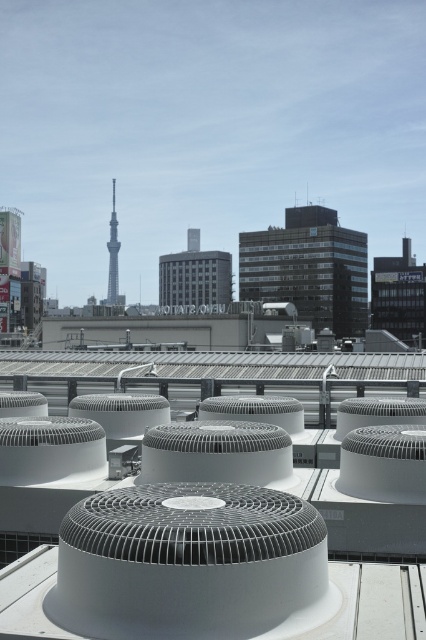
Question: Among these objects, which one is farthest from the camera?

Choices:
 (A) gray concrete building at center
 (B) silver metallic tower at center

Answer: (A)

Question: Which of the following is the closest to the observer?

Choices:
 (A) silver metallic tower at center
 (B) gray concrete building at center

Answer: (A)

Question: Is silver metallic tower at center closer to camera compared to gray concrete building at center?

Choices:
 (A) no
 (B) yes

Answer: (B)

Question: Is silver metallic tower at center smaller than gray concrete building at center?

Choices:
 (A) yes
 (B) no

Answer: (B)

Question: Is silver metallic tower at center to the right of gray concrete building at center from the viewer's perspective?

Choices:
 (A) yes
 (B) no

Answer: (B)